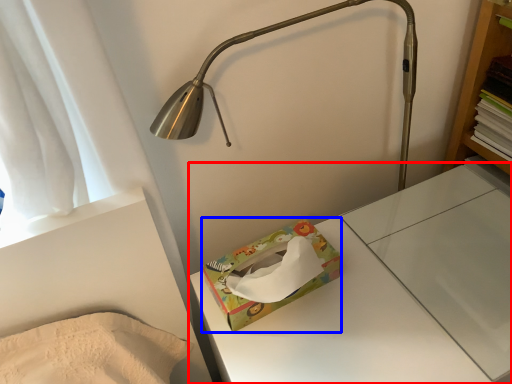
Question: Among these objects, which one is nearest to the camera, changing table (highlighted by a red box) or package (highlighted by a blue box)?

Choices:
 (A) changing table
 (B) package

Answer: (A)